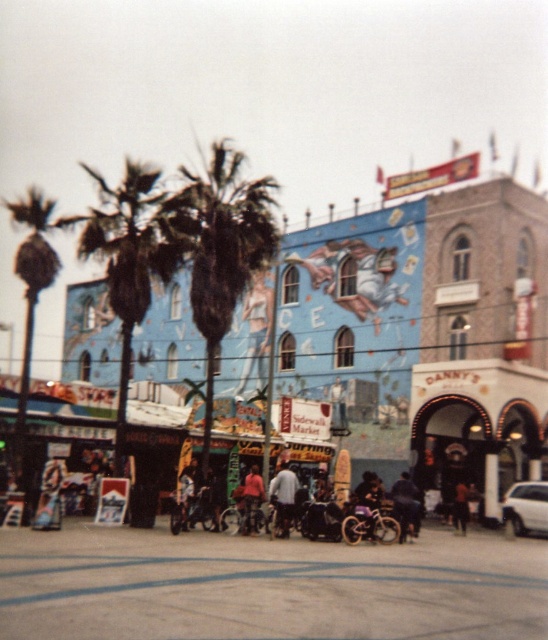
You are a tourist standing on Venice Beach and see the green leafy palm tree at left and the dark brown leather jacket at center. Which object is positioned further to the left?

The green leafy palm tree at left is positioned further to the left than the dark brown leather jacket at center.